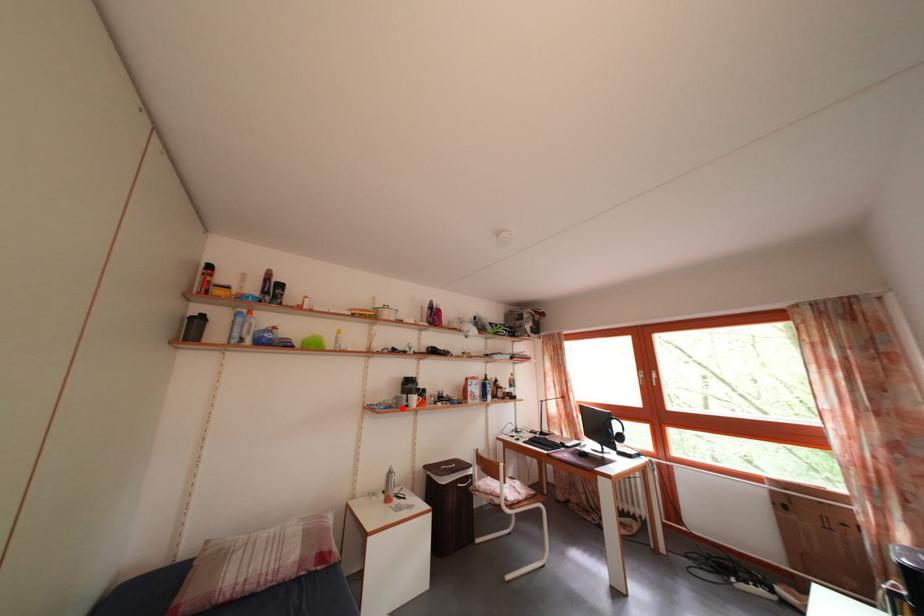
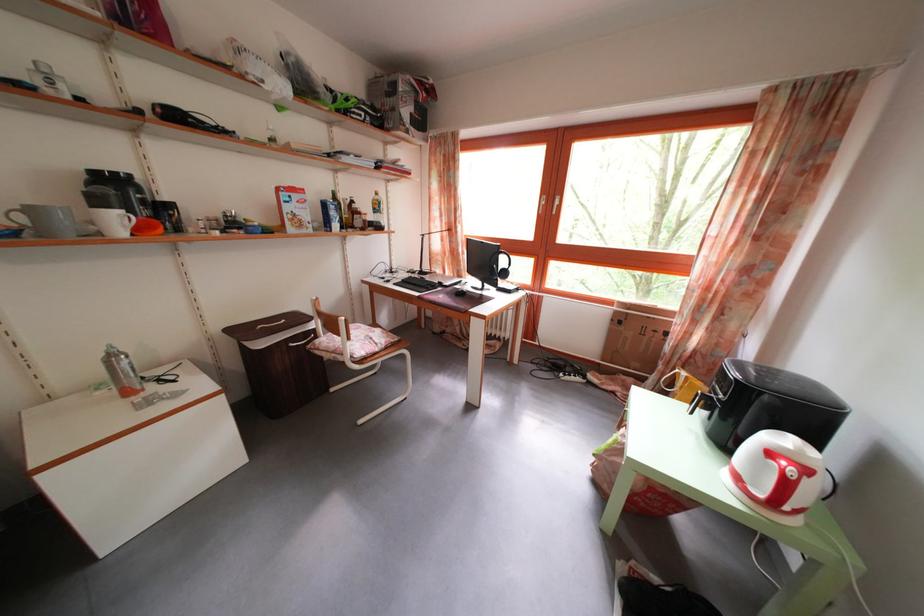
Question: I am providing you with two images of the same scene from different viewpoints. Image1 has a red point marked. In image2, the corresponding 3D location appears at what relative position? Reply with the corresponding letter.

Choices:
 (A) Closer
 (B) Farther

Answer: (A)